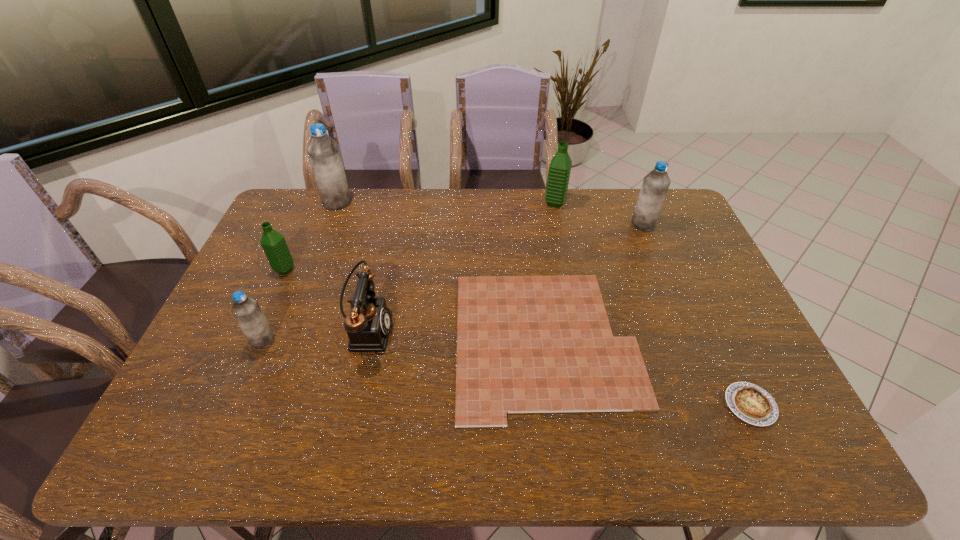
Identify the location of vacant space located 0.110m on the back of the quiche. (723, 347).

I want to click on free spot located 0.240m on the right of the shortest object, so click(x=727, y=341).

Find the location of a particular element. quiche that is at the near edge is located at coordinates (751, 403).

Where is `gameboard that is at the near edge`? This screenshot has width=960, height=540. gameboard that is at the near edge is located at coordinates click(525, 344).

Where is `water bottle at the right edge`? The width and height of the screenshot is (960, 540). water bottle at the right edge is located at coordinates (656, 183).

Identify the location of quiche situated at the right edge. (751, 403).

Identify the location of object that is at the far left corner. (323, 152).

At what (x,y) coordinates should I click in order to perform the action: click on object that is at the far right corner. Please return your answer as a coordinate pair (x, y). Looking at the image, I should click on (656, 183).

Identify the location of object that is at the near right corner. (751, 403).

Identify the location of vacant region at the far edge of the desktop. (554, 225).